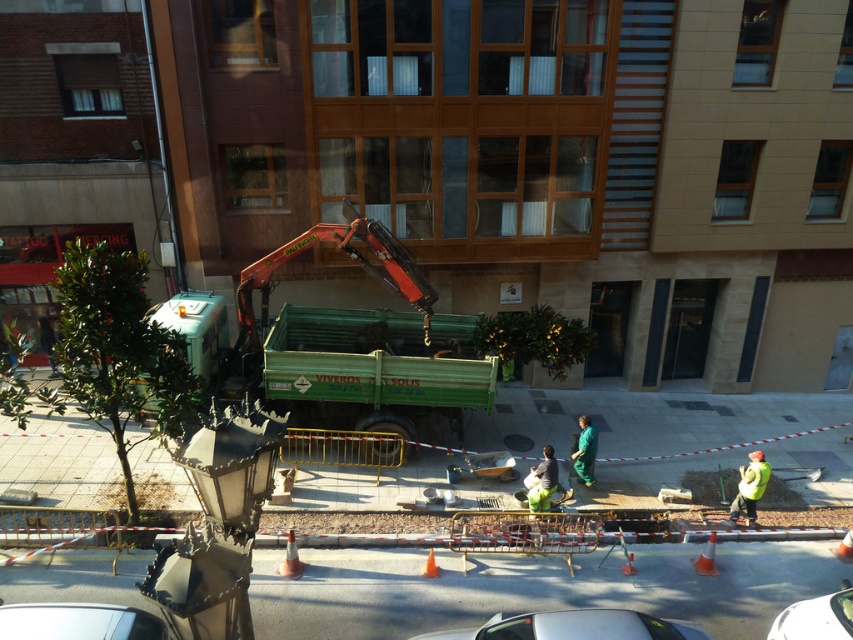
Question: In this image, where is shiny silver car at lower left located relative to high visibility yellow jacket at lower right?

Choices:
 (A) below
 (B) above

Answer: (A)

Question: Which of the following is the closest to the observer?

Choices:
 (A) (488, 628)
 (B) (575, 456)
 (C) (851, 598)

Answer: (A)

Question: Which object appears farthest from the camera in this image?

Choices:
 (A) high visibility yellow jacket at lower right
 (B) shiny silver car at lower left

Answer: (A)

Question: Does orange reflective cone at center appear on the right side of orange traffic cone at lower center?

Choices:
 (A) yes
 (B) no

Answer: (B)

Question: Which object is the farthest from the silver metallic car at lower center?

Choices:
 (A) orange traffic cone at lower center
 (B) high visibility yellow jacket at lower right
 (C) orange plastic cone at center

Answer: (B)

Question: Is green corrugated metal garbage truck at center further to camera compared to orange plastic cone at lower center?

Choices:
 (A) no
 (B) yes

Answer: (B)